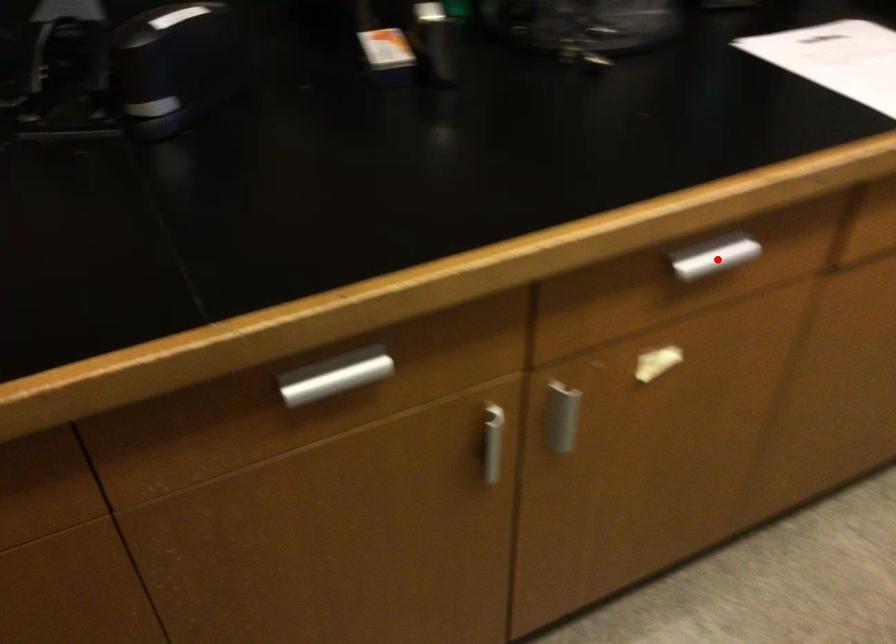
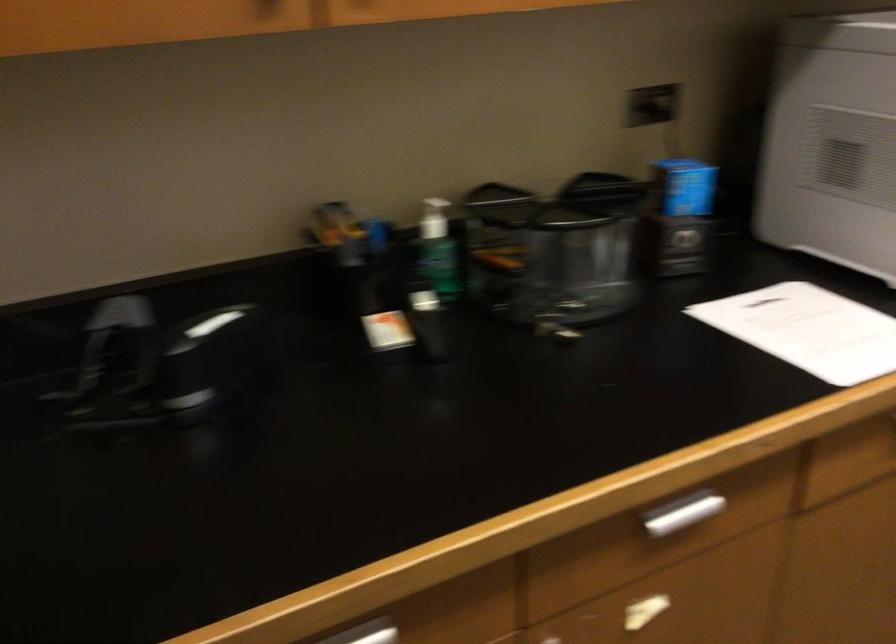
Question: A red point is marked in image1. In image2, is the corresponding 3D point closer to the camera or farther? Reply with the corresponding letter.

Choices:
 (A) The corresponding 3D point is closer.
 (B) The corresponding 3D point is farther.

Answer: (B)